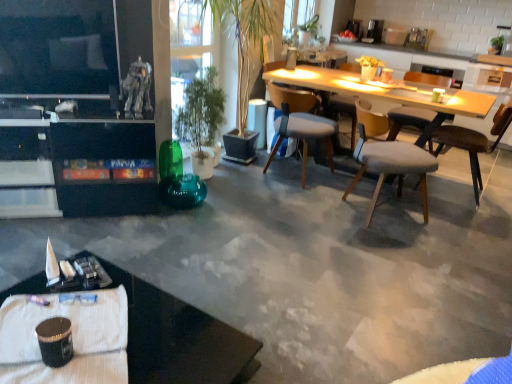
Identify the location of vacant space that is to the left of metallic pen at lower left. Image resolution: width=512 pixels, height=384 pixels. click(17, 300).